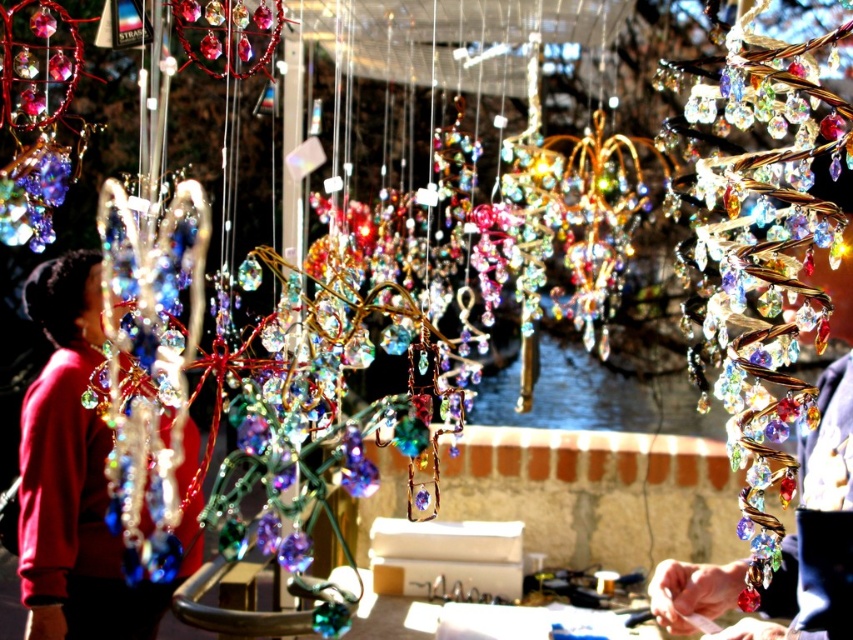
Question: Among these objects, which one is nearest to the camera?

Choices:
 (A) multicolored glass ornaments at center
 (B) matte red sweater at left

Answer: (A)

Question: Can you confirm if multicolored glass ornaments at center is positioned to the right of matte red sweater at left?

Choices:
 (A) yes
 (B) no

Answer: (A)

Question: Does multicolored glass ornaments at center have a greater width compared to matte red sweater at left?

Choices:
 (A) no
 (B) yes

Answer: (A)

Question: Can you confirm if multicolored glass ornaments at center is smaller than matte red sweater at left?

Choices:
 (A) no
 (B) yes

Answer: (B)